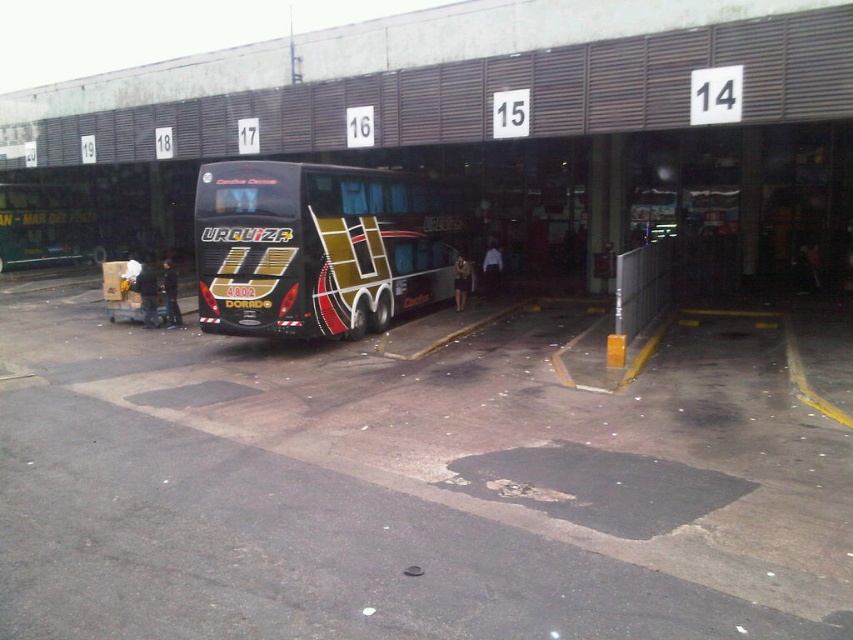
Question: Which object is closer to the camera taking this photo?

Choices:
 (A) metallic bus at center
 (B) shiny metallic bus at center

Answer: (B)

Question: Is metallic bus at center to the left of metallic gold bus at center from the viewer's perspective?

Choices:
 (A) yes
 (B) no

Answer: (A)

Question: Which object appears farthest from the camera in this image?

Choices:
 (A) metallic bus at center
 (B) metallic gold bus at center
 (C) shiny metallic bus at center

Answer: (B)

Question: Is metallic bus at center in front of metallic gold bus at center?

Choices:
 (A) yes
 (B) no

Answer: (A)

Question: Does shiny metallic bus at center appear under metallic gold bus at center?

Choices:
 (A) no
 (B) yes

Answer: (B)

Question: Among these objects, which one is nearest to the camera?

Choices:
 (A) metallic bus at center
 (B) shiny metallic bus at center
 (C) metallic gold bus at center

Answer: (B)